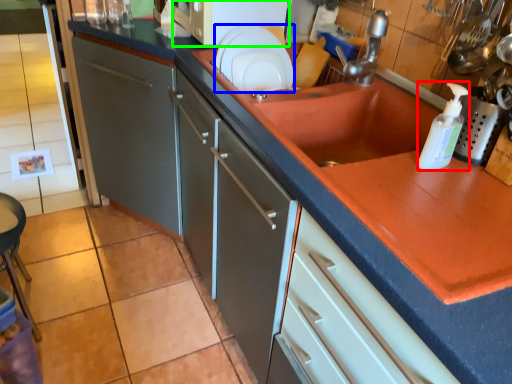
Question: Estimate the real-world distances between objects in this image. Which object is closer to bottle (highlighted by a red box), plate (highlighted by a blue box) or microwave (highlighted by a green box)?

Choices:
 (A) plate
 (B) microwave

Answer: (A)